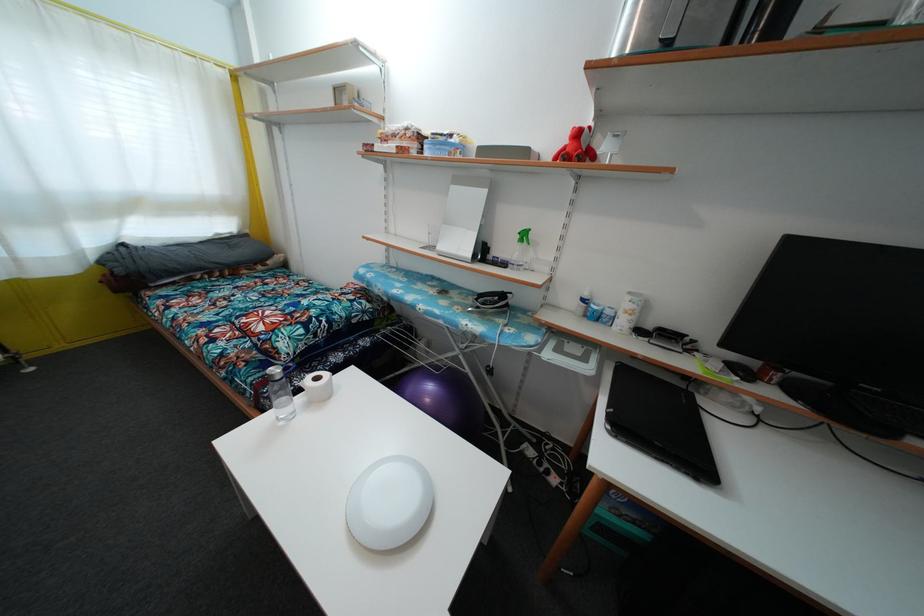
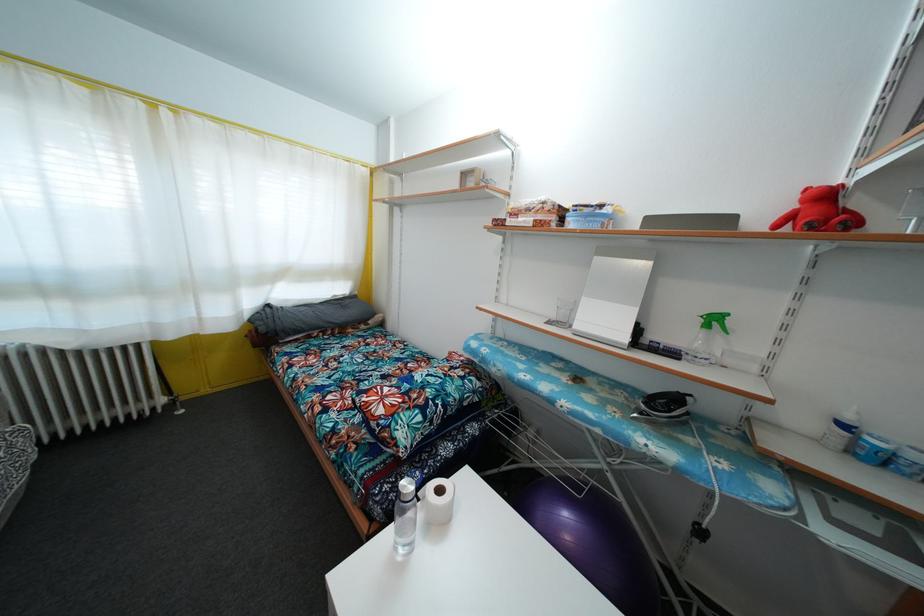
Locate, in the second image, the point that corresponds to the point at 397,142 in the first image.

(531, 216)